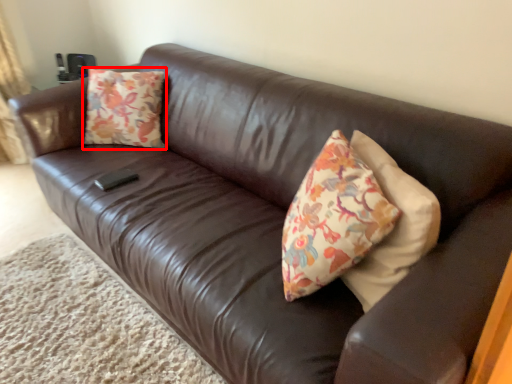
Question: From the image, what is the correct spatial relationship of throw pillow (annotated by the red box) in relation to plain?

Choices:
 (A) right
 (B) left

Answer: (A)